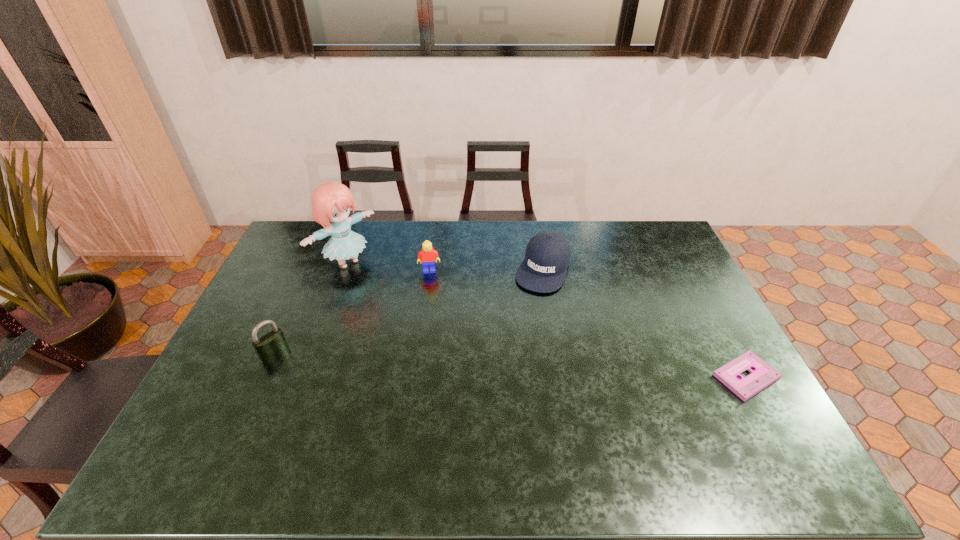
The height and width of the screenshot is (540, 960). In order to click on vacant space on the desktop that is between the padlock and the rightmost object and is positioned on the front-facing side of the third object from left to right in this screenshot , I will do `click(435, 361)`.

The image size is (960, 540). Identify the location of free spot on the desktop that is between the padlock and the rightmost object and is positioned on the front-facing side of the baseball cap. (501, 364).

Locate an element on the screen. free space on the desktop that is between the padlock and the videotape and is positioned on the front-facing side of the tallest object is located at coordinates (475, 363).